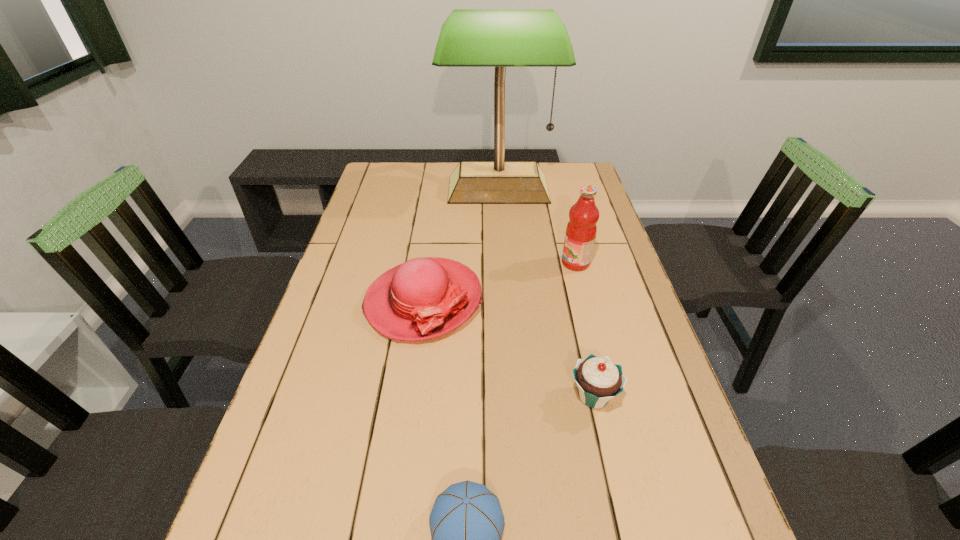
Locate an element on the screen. The width and height of the screenshot is (960, 540). vacant point that satisfies the following two spatial constraints: 1. on the metallic stand of the table lamp; 2. on the left side of the second nearest object is located at coordinates (511, 396).

Identify the location of vacant space that satisfies the following two spatial constraints: 1. on the metallic stand of the cupcake; 2. on the right side of the farthest object. (511, 396).

The image size is (960, 540). I want to click on free point that satisfies the following two spatial constraints: 1. at the front of the cupcake with a bow; 2. on the left side of the hat, so click(410, 396).

Where is `vacant area in the image that satisfies the following two spatial constraints: 1. at the front of the hat with a bow; 2. on the left side of the second nearest object`? vacant area in the image that satisfies the following two spatial constraints: 1. at the front of the hat with a bow; 2. on the left side of the second nearest object is located at coordinates (x=410, y=396).